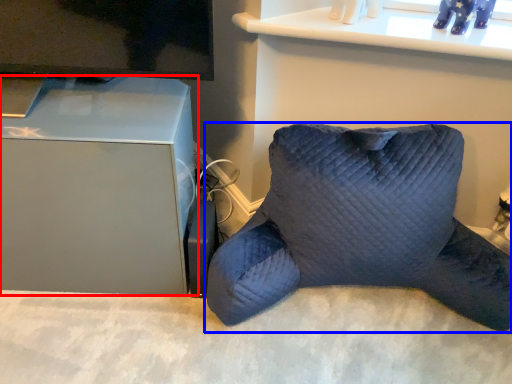
Question: Which object is closer to the camera taking this photo, furniture (highlighted by a red box) or pillow (highlighted by a blue box)?

Choices:
 (A) furniture
 (B) pillow

Answer: (B)